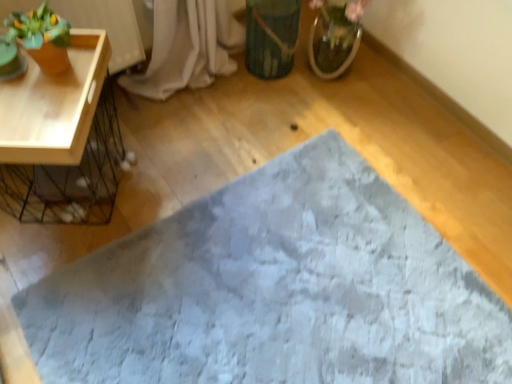
You are a GUI agent. You are given a task and a screenshot of the screen. Output one action in this format:
    pyautogui.click(x=<x>, y=<y>)
    Task: Click on the unoccupied space behind gray textured bath mat at center
    This screenshot has height=384, width=512.
    Given the screenshot: What is the action you would take?
    coord(273,130)